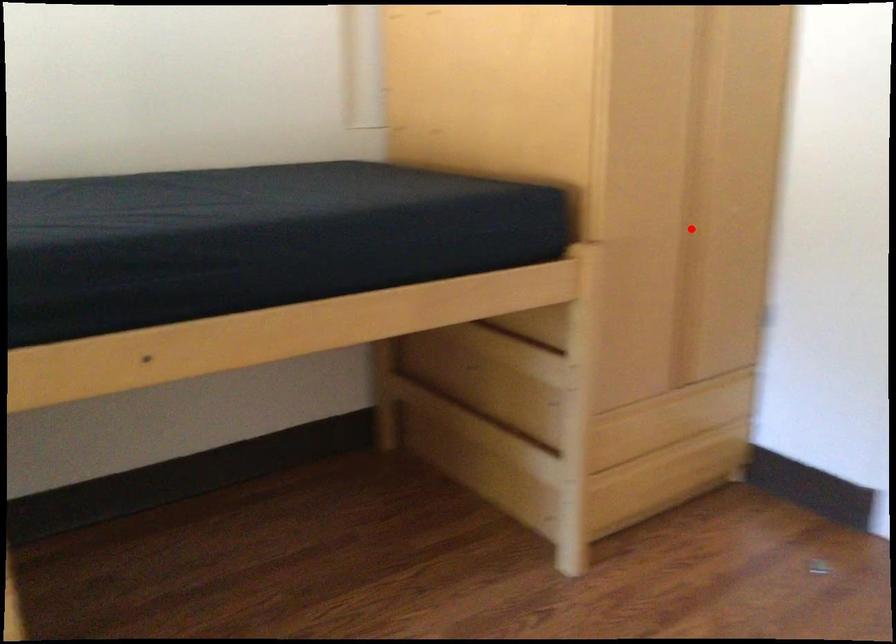
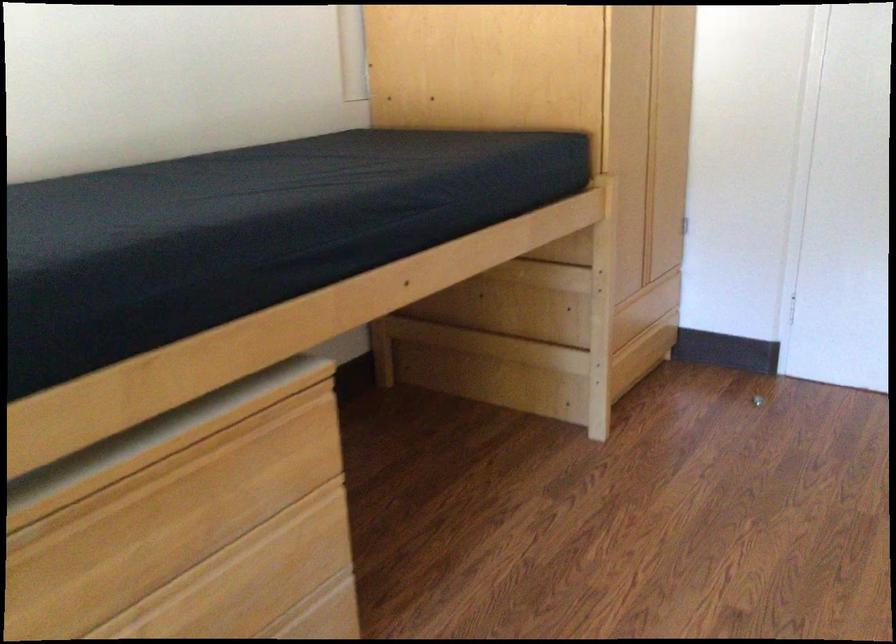
Question: I am providing you with two images of the same scene from different viewpoints. A red point is marked on the first image. At the location where the point appears in image 1, is it still visible in image 2?

Choices:
 (A) Yes
 (B) No

Answer: (A)